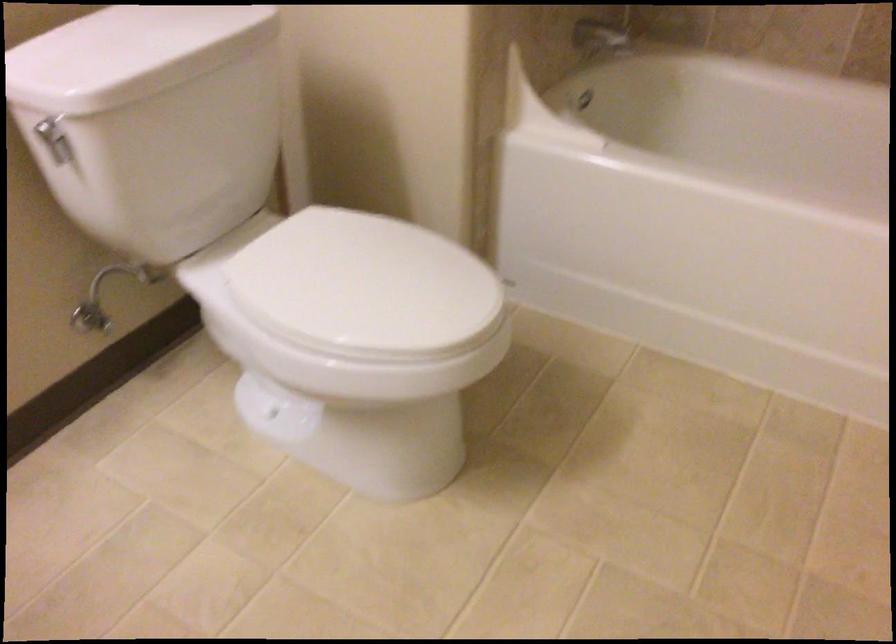
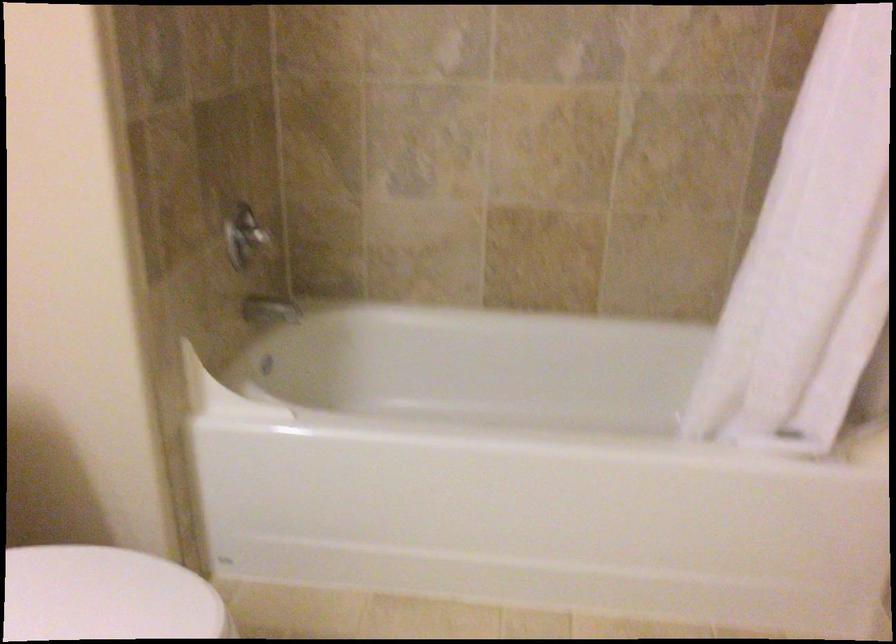
Which direction would the cameraman need to move to produce the second image?

The cameraman walked toward right, backward.